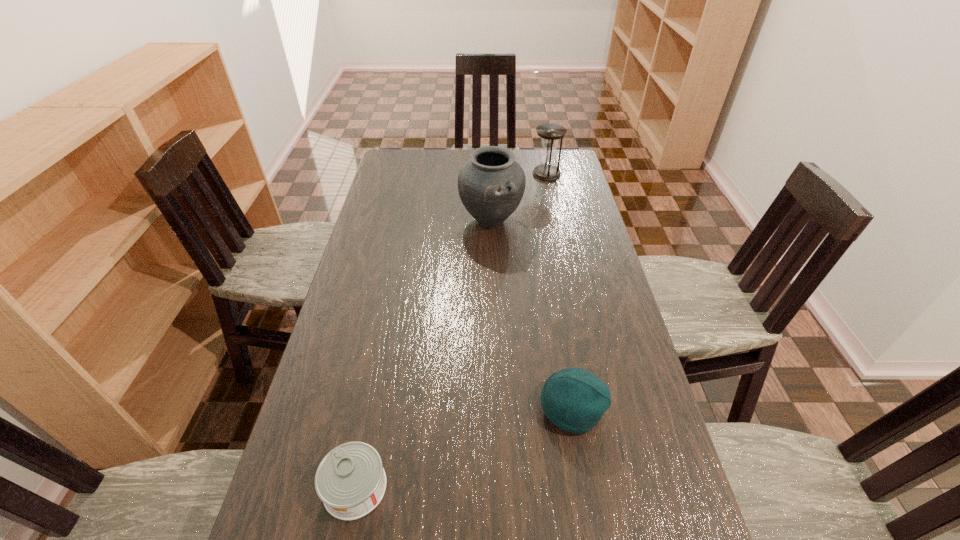
Locate an element on the screen. vacant space situated 0.120m on the front of the third tallest object is located at coordinates (586, 492).

Locate an element on the screen. This screenshot has width=960, height=540. vacant region located 0.160m on the right of the can is located at coordinates (464, 487).

Find the location of a particular element. This screenshot has height=540, width=960. object located at the far edge is located at coordinates (550, 134).

The width and height of the screenshot is (960, 540). Identify the location of object that is at the left edge. (350, 480).

I want to click on hourglass located in the right edge section of the desktop, so click(550, 134).

Locate an element on the screen. This screenshot has width=960, height=540. beanie that is positioned at the right edge is located at coordinates (573, 399).

The image size is (960, 540). Identify the location of object present at the far right corner. (550, 134).

Image resolution: width=960 pixels, height=540 pixels. What are the coordinates of `free point at the far edge` in the screenshot? It's located at (457, 165).

This screenshot has width=960, height=540. In the image, there is a desktop. Find the location of `vacant space at the left edge`. vacant space at the left edge is located at coordinates (413, 183).

The image size is (960, 540). In order to click on free space at the right edge in this screenshot , I will do click(x=561, y=192).